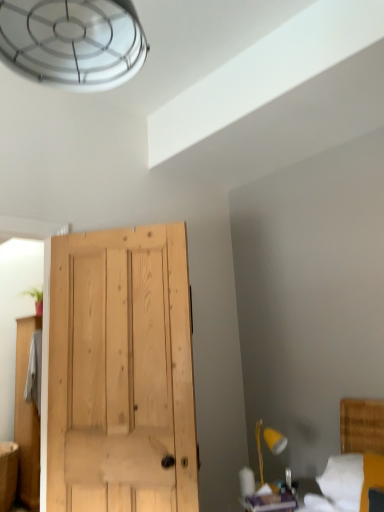
I want to click on matte wood vanity at lower left, so click(8, 474).

At what (x,y) coordinates should I click in order to perform the action: click on white fabric bed at lower right. Please return your answer as a coordinate pair (x, y). Looking at the image, I should click on coord(357,452).

Looking at this image, which point is more distant from viewer, [351,469] or [272,452]?

The point [272,452] is behind.

Between white fabric bed at lower right and yellow wood lamp at lower right, which one is positioned behind?

yellow wood lamp at lower right is more distant.

Does white fabric bed at lower right appear on the right side of yellow wood lamp at lower right?

Yes.

From a real-world perspective, is yellow wood lamp at lower right above or below matte wood vanity at lower left?

yellow wood lamp at lower right is above matte wood vanity at lower left.

From the image's perspective, does yellow wood lamp at lower right appear lower than matte wood vanity at lower left?

Actually, yellow wood lamp at lower right appears above matte wood vanity at lower left in the image.

What's the angular difference between yellow wood lamp at lower right and matte wood vanity at lower left's facing directions?

yellow wood lamp at lower right and matte wood vanity at lower left are facing 106 degrees away from each other.

Considering the sizes of objects yellow wood lamp at lower right and matte wood vanity at lower left in the image provided, who is bigger, yellow wood lamp at lower right or matte wood vanity at lower left?

Bigger between the two is matte wood vanity at lower left.

Who is bigger, yellow wood lamp at lower right or white fabric bed at lower right?

white fabric bed at lower right.

Between yellow wood lamp at lower right and white fabric bed at lower right, which one appears on the right side from the viewer's perspective?

Positioned to the right is white fabric bed at lower right.

Is yellow wood lamp at lower right aimed at white fabric bed at lower right?

No, yellow wood lamp at lower right is not oriented towards white fabric bed at lower right.

Can you see yellow wood lamp at lower right touching white fabric bed at lower right?

No, yellow wood lamp at lower right is not beside white fabric bed at lower right.

Which is behind, point (17, 475) or point (370, 467)?

Positioned behind is point (17, 475).

This screenshot has height=512, width=384. I want to click on bed on the right of matte wood vanity at lower left, so click(x=357, y=452).

Which of these two, matte wood vanity at lower left or white fabric bed at lower right, stands taller?

matte wood vanity at lower left.

From the image's perspective, is matte wood vanity at lower left beneath white fabric bed at lower right?

Yes, from the image's perspective, matte wood vanity at lower left is beneath white fabric bed at lower right.

Can you tell me how much white fabric bed at lower right and matte wood vanity at lower left differ in facing direction?

The angle between the facing direction of white fabric bed at lower right and the facing direction of matte wood vanity at lower left is 96.3 degrees.

In terms of height, does white fabric bed at lower right look taller or shorter compared to matte wood vanity at lower left?

white fabric bed at lower right is shorter than matte wood vanity at lower left.

The image size is (384, 512). Find the location of `bed above the matte wood vanity at lower left (from the image's perspective)`. bed above the matte wood vanity at lower left (from the image's perspective) is located at coordinates (357, 452).

Is matte wood vanity at lower left in contact with yellow wood lamp at lower right?

matte wood vanity at lower left and yellow wood lamp at lower right are clearly separated.

Considering their positions, is matte wood vanity at lower left located in front of or behind yellow wood lamp at lower right?

Visually, matte wood vanity at lower left is located behind yellow wood lamp at lower right.

Can you confirm if matte wood vanity at lower left is smaller than yellow wood lamp at lower right?

No.

Locate an element on the screen. The image size is (384, 512). light fixture on the left of white fabric bed at lower right is located at coordinates (275, 440).

There is a matte wood vanity at lower left. Where is `light fixture above it (from a real-world perspective)`? This screenshot has width=384, height=512. light fixture above it (from a real-world perspective) is located at coordinates (275, 440).

Which object lies nearer to the anchor point white fabric bed at lower right, matte wood vanity at lower left or yellow wood lamp at lower right?

yellow wood lamp at lower right lies closer to white fabric bed at lower right than the other object.

Looking at the image, which one is located further to matte wood vanity at lower left, yellow wood lamp at lower right or white fabric bed at lower right?

Based on the image, white fabric bed at lower right appears to be further to matte wood vanity at lower left.

When comparing their distances from matte wood vanity at lower left, does white fabric bed at lower right or yellow wood lamp at lower right seem further?

The object further to matte wood vanity at lower left is white fabric bed at lower right.

Based on their spatial positions, is matte wood vanity at lower left or white fabric bed at lower right further from yellow wood lamp at lower right?

matte wood vanity at lower left.

From the image, which object appears to be nearer to white fabric bed at lower right, yellow wood lamp at lower right or matte wood vanity at lower left?

yellow wood lamp at lower right lies closer to white fabric bed at lower right than the other object.

In the scene shown: Considering their positions, is white fabric bed at lower right positioned closer to yellow wood lamp at lower right than matte wood vanity at lower left?

The object closer to yellow wood lamp at lower right is white fabric bed at lower right.

Find the location of a particular element. The width and height of the screenshot is (384, 512). light fixture situated between matte wood vanity at lower left and white fabric bed at lower right from left to right is located at coordinates (275, 440).